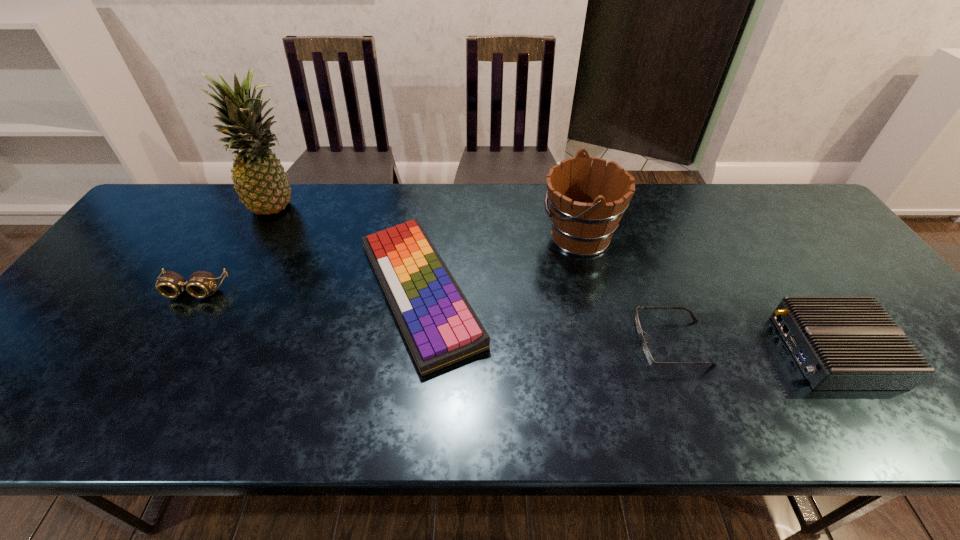
This screenshot has height=540, width=960. I want to click on pineapple positioned at the far edge, so click(x=259, y=178).

This screenshot has height=540, width=960. In order to click on wine bucket that is at the far edge in this screenshot , I will do `click(587, 202)`.

The width and height of the screenshot is (960, 540). I want to click on computer keyboard that is at the far edge, so click(440, 327).

Locate an element on the screen. This screenshot has width=960, height=540. object present at the right edge is located at coordinates (840, 343).

The image size is (960, 540). In the image, there is a desktop. Find the location of `free space at the far edge`. free space at the far edge is located at coordinates (349, 211).

At what (x,y) coordinates should I click in order to perform the action: click on vacant space at the near edge. Please return your answer as a coordinate pair (x, y). Looking at the image, I should click on (126, 409).

The width and height of the screenshot is (960, 540). Identify the location of vacant space at the near right corner. (927, 420).

I want to click on free space that is in between the tallest object and the fourth shortest object, so click(x=557, y=278).

Find the location of a particular element. The image size is (960, 540). vacant space in between the fourth shortest object and the wine bucket is located at coordinates (707, 294).

The image size is (960, 540). What are the coordinates of `vacant space in between the spectacles and the pineapple` in the screenshot? It's located at (476, 274).